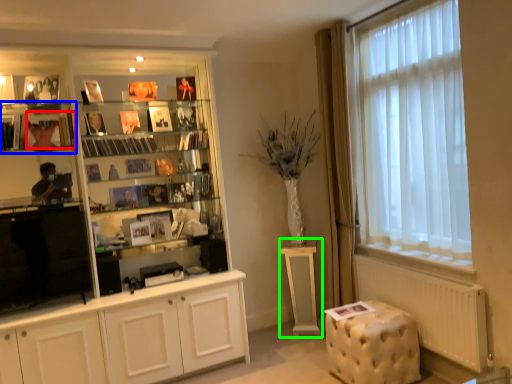
Question: Considering the real-world distances, which object is farthest from book (highlighted by a red box)? shelf (highlighted by a blue box) or table (highlighted by a green box)?

Choices:
 (A) shelf
 (B) table

Answer: (B)